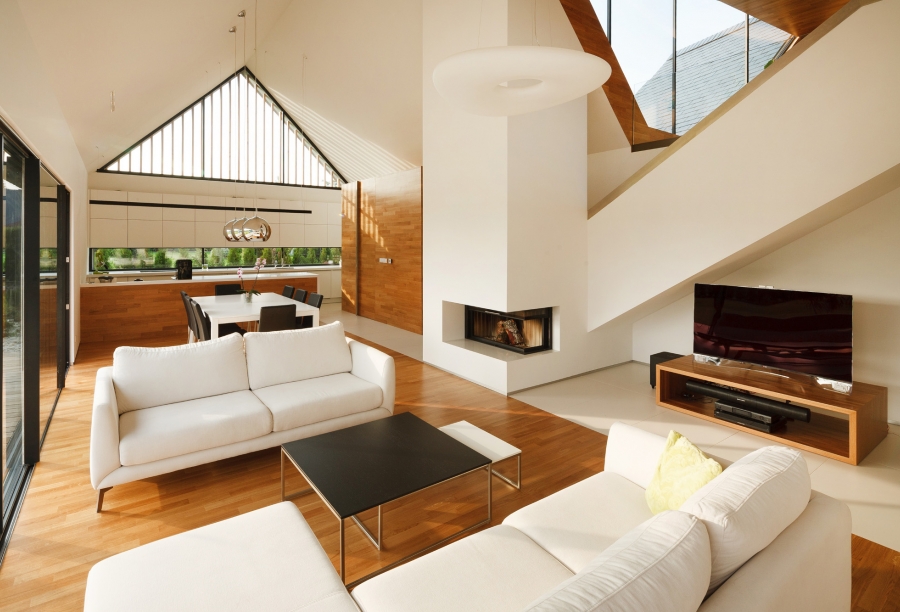
This screenshot has height=612, width=900. What are the coordinates of `over head ceiling light living room` in the screenshot? It's located at (450, 91).